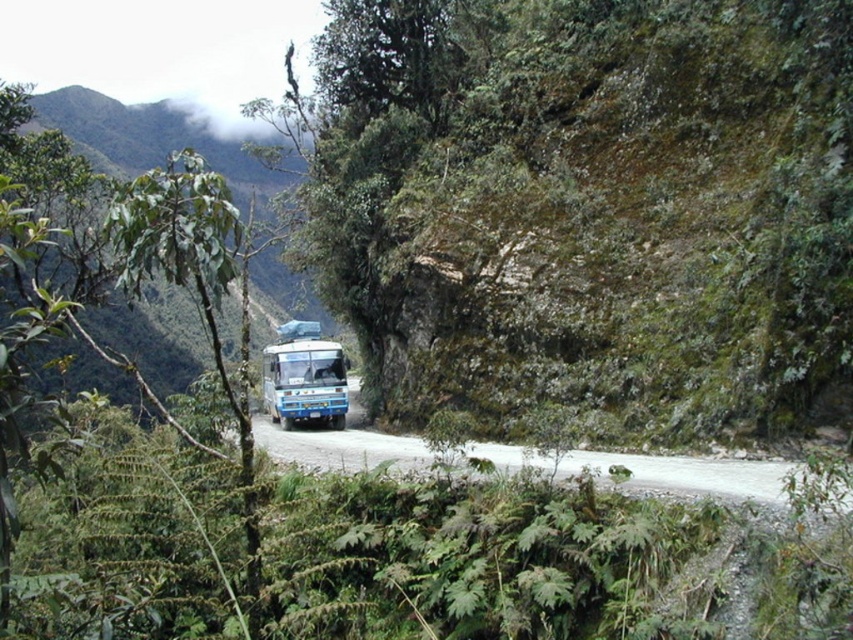
Question: Among these points, which one is farthest from the camera?

Choices:
 (A) (312, 337)
 (B) (688, 456)
 (C) (135, 310)
 (D) (775, 371)

Answer: (C)

Question: Is green leafy tree at center smaller than green leafy mountain at center?

Choices:
 (A) yes
 (B) no

Answer: (A)

Question: Which point appears farthest from the camera in this image?

Choices:
 (A) (264, 404)
 (B) (154, 112)

Answer: (B)

Question: Estimate the real-world distances between objects in this image. Which object is closer to the green leafy mountain at center?

Choices:
 (A) gray gravel road at center
 (B) blue matte bus at center

Answer: (B)

Question: In this image, where is green leafy tree at center located relative to gray gravel road at center?

Choices:
 (A) above
 (B) below

Answer: (A)

Question: Can you confirm if green leafy tree at center is smaller than gray gravel road at center?

Choices:
 (A) yes
 (B) no

Answer: (B)